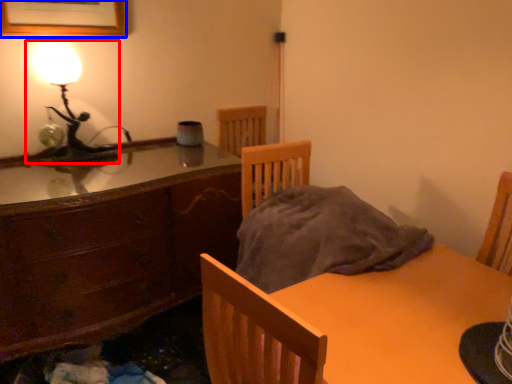
Question: Which object appears farthest to the camera in this image, lamp (highlighted by a red box) or picture frame (highlighted by a blue box)?

Choices:
 (A) lamp
 (B) picture frame

Answer: (A)